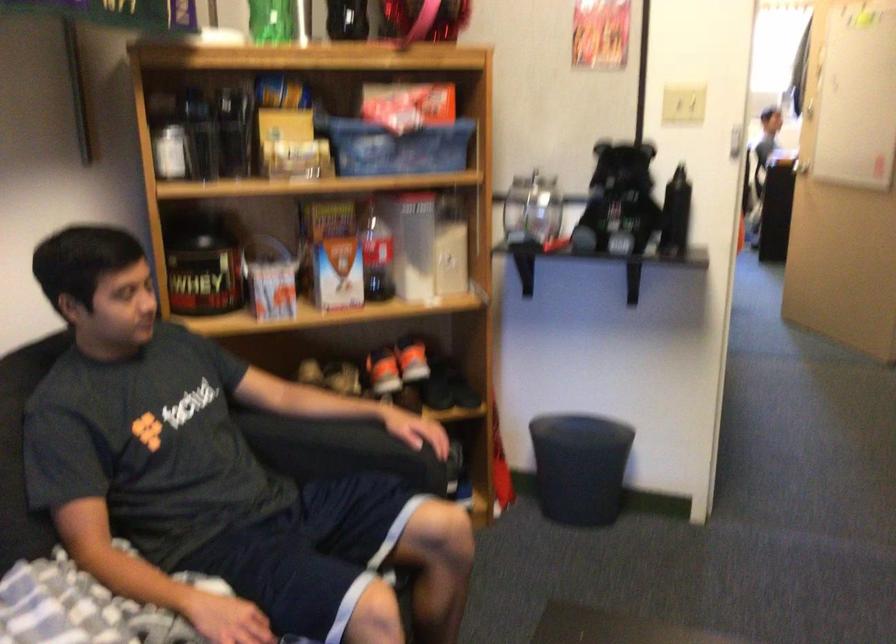
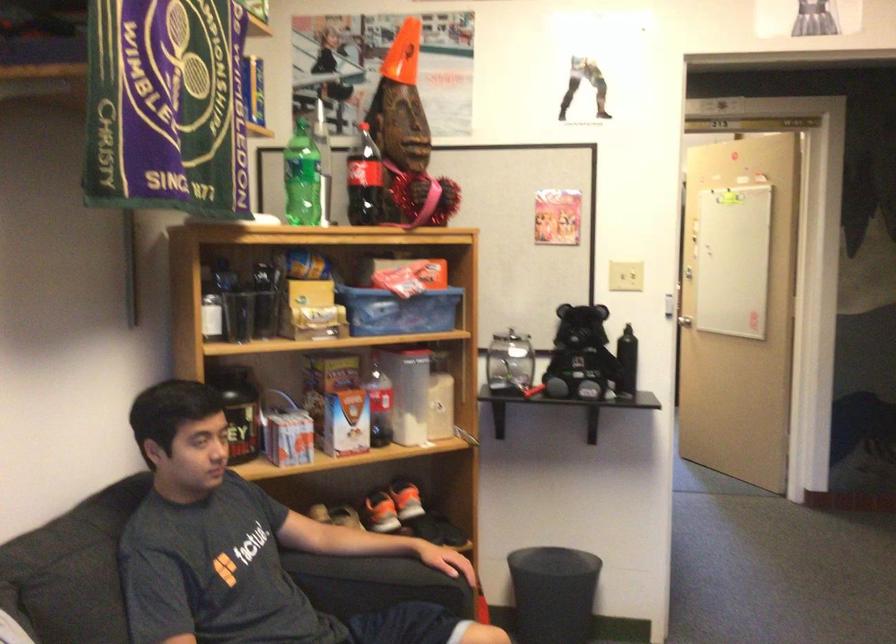
Question: The images are taken continuously from a first-person perspective. In which direction is your viewpoint rotating?

Choices:
 (A) Left
 (B) Right
 (C) Up
 (D) Down

Answer: (C)